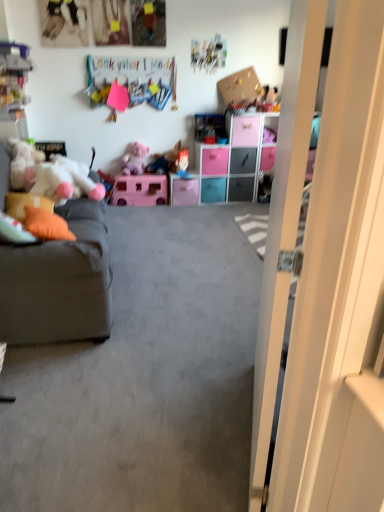
At what (x,y) coordinates should I click in order to perform the action: click on free point in front of black plastic drawer at center, the 3th drawer when ordered from right to left. Please return your answer as a coordinate pair (x, y). This screenshot has height=512, width=384. Looking at the image, I should click on (237, 207).